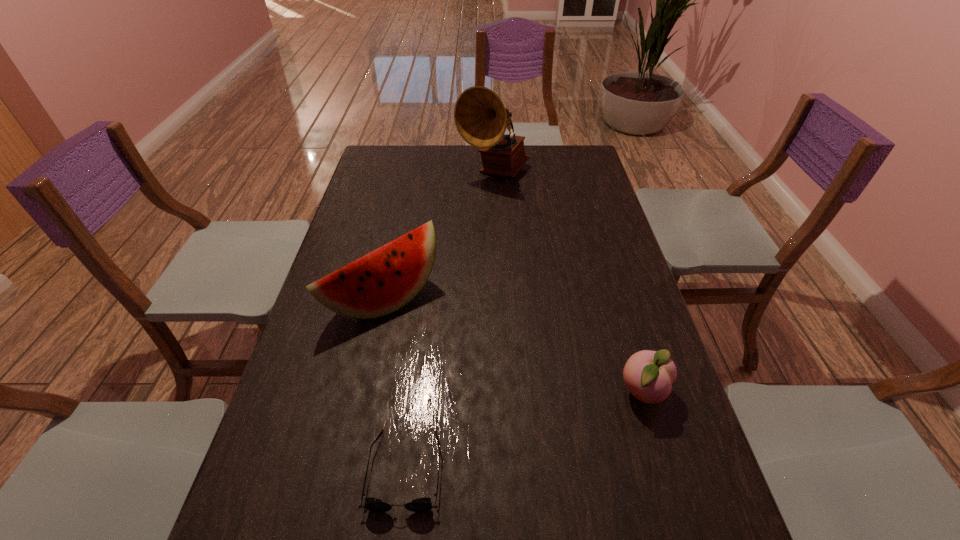
This screenshot has width=960, height=540. Identify the location of vacant space situated on the outer rind of the third nearest object. 443,345.

At what (x,y) coordinates should I click in order to perform the action: click on free space located on the outer rind of the third nearest object. Please return your answer as a coordinate pair (x, y). Looking at the image, I should click on (478, 376).

Locate an element on the screen. The width and height of the screenshot is (960, 540). vacant area located 0.350m on the horn of the phonograph record is located at coordinates (499, 254).

Find the location of a particular element. This screenshot has height=540, width=960. free space located on the horn of the phonograph record is located at coordinates (495, 201).

Locate an element on the screen. free spot located on the horn of the phonograph record is located at coordinates (496, 211).

Find the location of a particular element. This screenshot has width=960, height=540. object that is at the far edge is located at coordinates (481, 118).

Locate an element on the screen. object that is at the near edge is located at coordinates (424, 504).

At what (x,y) coordinates should I click in order to perform the action: click on object that is positioned at the left edge. Please return your answer as a coordinate pair (x, y). Looking at the image, I should click on (386, 279).

Where is `object located at the right edge`? object located at the right edge is located at coordinates (648, 375).

Where is `vacant space at the far edge of the desktop`? This screenshot has width=960, height=540. vacant space at the far edge of the desktop is located at coordinates (414, 167).